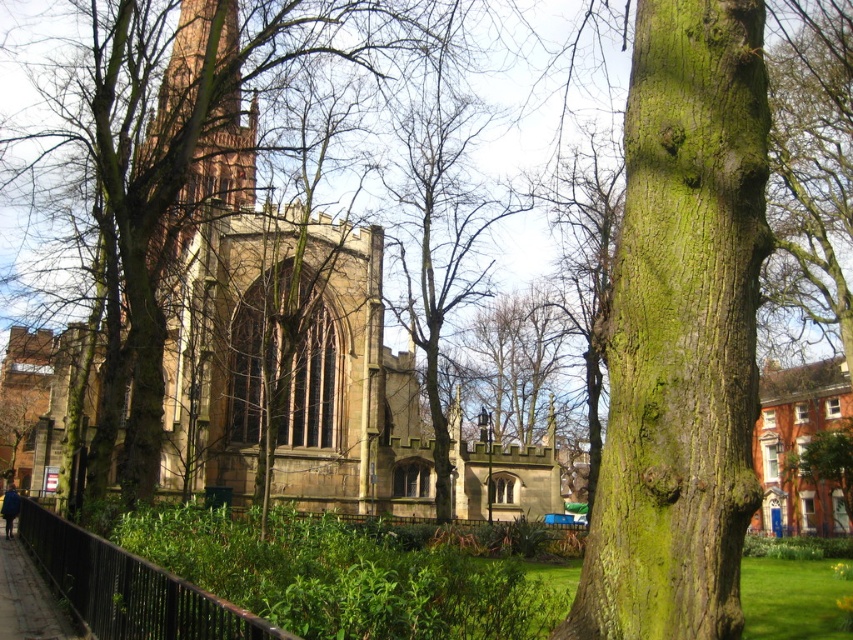
Can you confirm if brown stone church at center is thinner than dark gray concrete pavement at lower left?

No.

Does brown stone church at center have a smaller size compared to dark gray concrete pavement at lower left?

Incorrect, brown stone church at center is not smaller in size than dark gray concrete pavement at lower left.

Where is `brown stone church at center`? The image size is (853, 640). brown stone church at center is located at coordinates (302, 358).

Who is more forward, (x=320, y=369) or (x=657, y=568)?

Point (x=657, y=568)

Does brown stone church at center have a lesser height compared to green mossy bark tree at center?

No.

This screenshot has height=640, width=853. I want to click on brown stone church at center, so click(x=302, y=358).

You are a GUI agent. You are given a task and a screenshot of the screen. Output one action in this format:
    pyautogui.click(x=<x>, y=<y>)
    Task: Click on the brown stone church at center
    Image resolution: width=853 pixels, height=640 pixels.
    Given the screenshot: What is the action you would take?
    pyautogui.click(x=302, y=358)

Is brown stone church at center bigger than black metal fence at lower left?

Yes.

Which is more to the right, brown stone church at center or black metal fence at lower left?

brown stone church at center is more to the right.

Who is more forward, (512, 464) or (128, 636)?

Point (128, 636)

The height and width of the screenshot is (640, 853). Identify the location of brown stone church at center. (x=302, y=358).